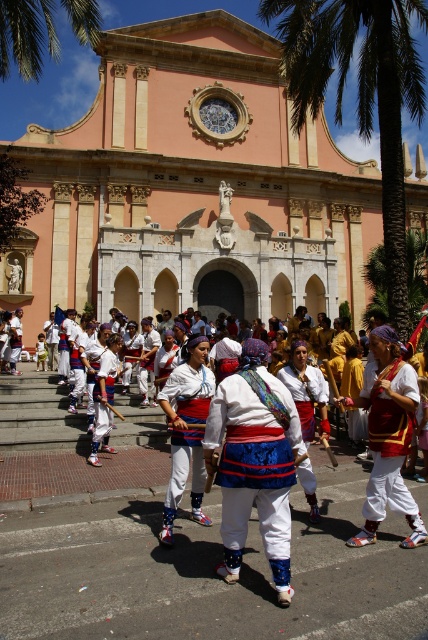
You are standing at the center of the street in front of the pink stone church at center. If you walk straight ahead, will you eventually reach the building with the circular stained glass window?

Yes, because the pink stone church at center is part of the building with the circular stained glass window at its top center, so walking straight ahead from the church would lead towards the building itself.

You are a photographer standing 10 meters away from the pink stone church at center. You want to take a photo of the white cotton costumes at center without the church in the frame. Is it possible to step back enough to exclude the church from the photo?

The distance between the pink stone church at center and the white cotton costumes at center is 33.29 meters. If you are currently 10 meters away from the church, stepping back would increase the distance between you and both objects. However, since the church and the costumes are already 33.29 meters apart, you would need to position yourself far enough behind the costumes so that the church is no longer in the camera frame. This would require moving beyond the 33.29 meters separation, but practically, the

You are standing in front of the ornate pink building and notice two points marked in the scene. Which point, point [107,468] or point [372,64], is closer to you?

Point [107,468] is closer to the viewer than point [372,64].